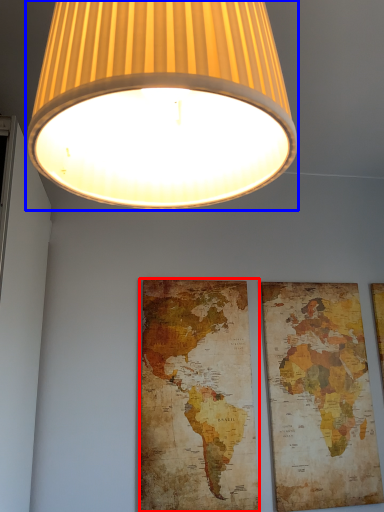
Question: Which object appears closest to the camera in this image, map (highlighted by a red box) or lamp (highlighted by a blue box)?

Choices:
 (A) map
 (B) lamp

Answer: (B)